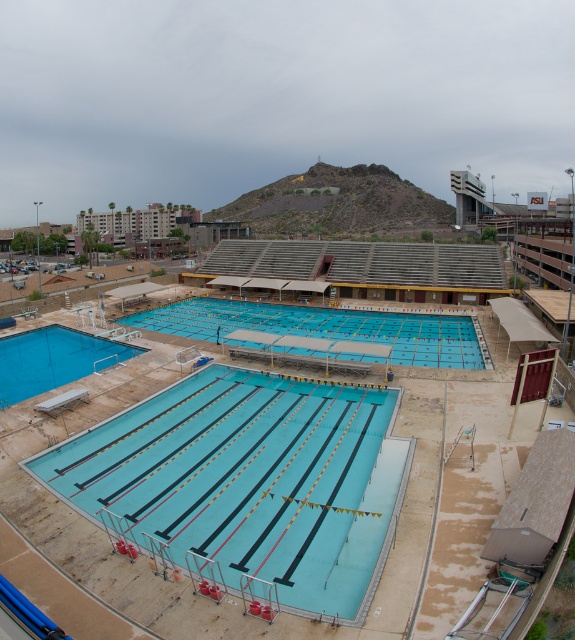
Which is above, clear blue pool at center or smooth blue pool at bottom left?

Positioned higher is smooth blue pool at bottom left.

Between point (260, 381) and point (9, 349), which one is positioned in front?

Point (260, 381) is in front.

Find the location of `clear blue pool at center`. clear blue pool at center is located at coordinates (248, 483).

Does blue smooth pool at center have a greater width compared to smooth blue pool at bottom left?

Indeed, blue smooth pool at center has a greater width compared to smooth blue pool at bottom left.

How much distance is there between blue smooth pool at center and smooth blue pool at bottom left?

blue smooth pool at center and smooth blue pool at bottom left are 15.49 meters apart.

Where is `blue smooth pool at center`? This screenshot has width=575, height=640. blue smooth pool at center is located at coordinates (323, 326).

Does clear blue pool at center have a lesser width compared to blue smooth pool at center?

Yes.

Who is positioned more to the right, clear blue pool at center or blue smooth pool at center?

From the viewer's perspective, blue smooth pool at center appears more on the right side.

Does point (301, 388) lie behind point (144, 310)?

No, it is in front of (144, 310).

I want to click on clear blue pool at center, so click(x=248, y=483).